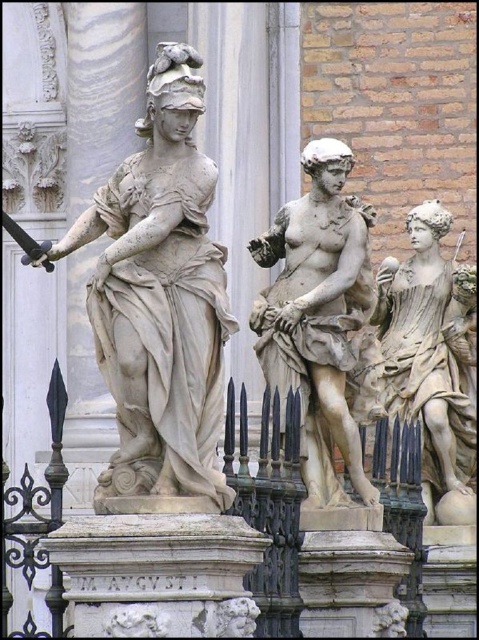
You are a visitor standing in front of the matte stone statue at center. You want to walk directly behind it to take a photo. Is the black wrought iron fence at center blocking your path?

The matte stone statue at center is positioned over the black wrought iron fence at center, so the statue is blocking the path behind it. You cannot walk directly behind the statue without going around it.

Based on the coordinates provided in the scene description, where exactly is the white marble statue at center located?

The white marble statue at center is located at the coordinates point (160, 296).

You are a visitor standing in front of the matte stone statue at center and the black wrought iron fence at center. Which object is closer to you?

The matte stone statue at center is closer to you than the black wrought iron fence at center, as it is positioned further away.